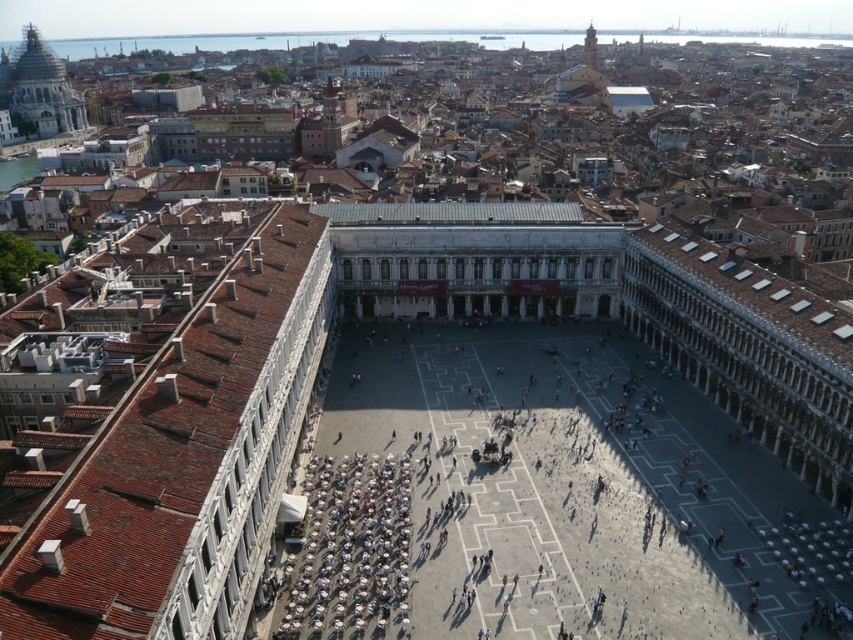
Question: Is terracotta tiled roof at left positioned before white marble dome at upper left?

Choices:
 (A) no
 (B) yes

Answer: (B)

Question: Which of the following is the closest to the observer?

Choices:
 (A) white stone square at center
 (B) white marble dome at upper left
 (C) terracotta tiled roof at left
 (D) white plastic chairs at lower left

Answer: (C)

Question: Is white stone square at center positioned behind terracotta tiled roof at left?

Choices:
 (A) no
 (B) yes

Answer: (B)

Question: Which point appears farthest from the camera in this image?

Choices:
 (A) (33, 60)
 (B) (277, 596)
 (C) (498, 618)

Answer: (A)

Question: Which object is closer to the camera taking this photo?

Choices:
 (A) white marble dome at upper left
 (B) terracotta tiled roof at left
 (C) white stone square at center
 (D) white plastic chairs at lower left

Answer: (B)

Question: Is white stone square at center closer to camera compared to terracotta tiled roof at left?

Choices:
 (A) no
 (B) yes

Answer: (A)